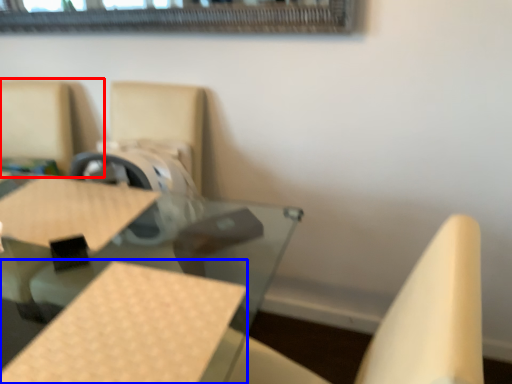
Question: Among these objects, which one is farthest to the camera, chair (highlighted by a red box) or plywood (highlighted by a blue box)?

Choices:
 (A) chair
 (B) plywood

Answer: (A)